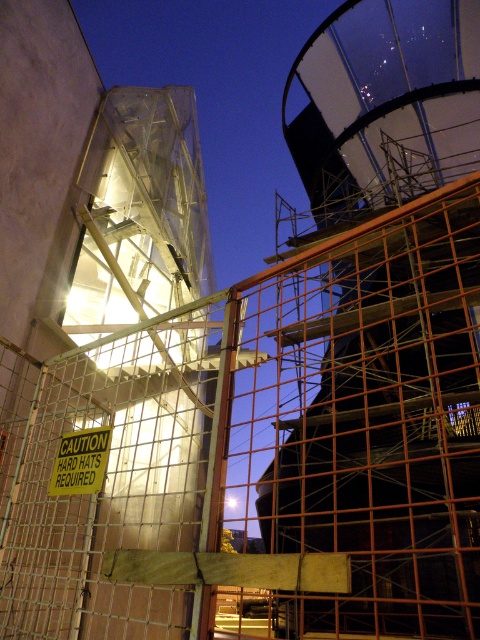
You are a safety inspector at the construction site. You need to ensure that the yellow paper sign at center is visible to workers standing at the entrance. Given that the metal grid fence at center is in between, will the sign be visible over the fence?

The metal grid fence at center is taller than the yellow paper sign at center, so the sign will not be visible over the fence to workers at the entrance.

Based on the scene description, what object is located at the coordinates point (271,449)?

The metal grid fence at center is located at point (271,449).